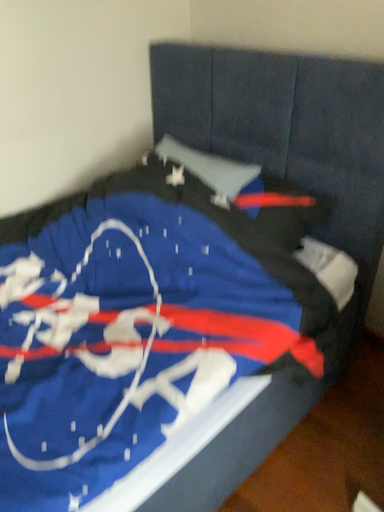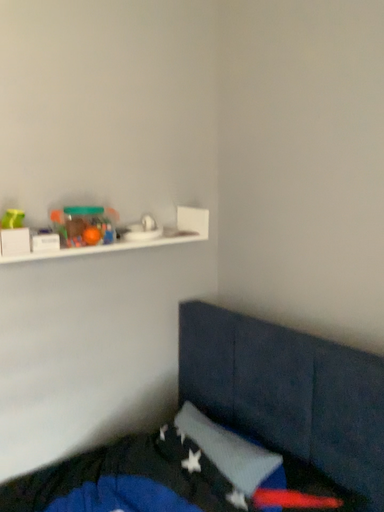
Question: How did the camera likely rotate when shooting the video?

Choices:
 (A) rotated downward
 (B) rotated upward

Answer: (B)